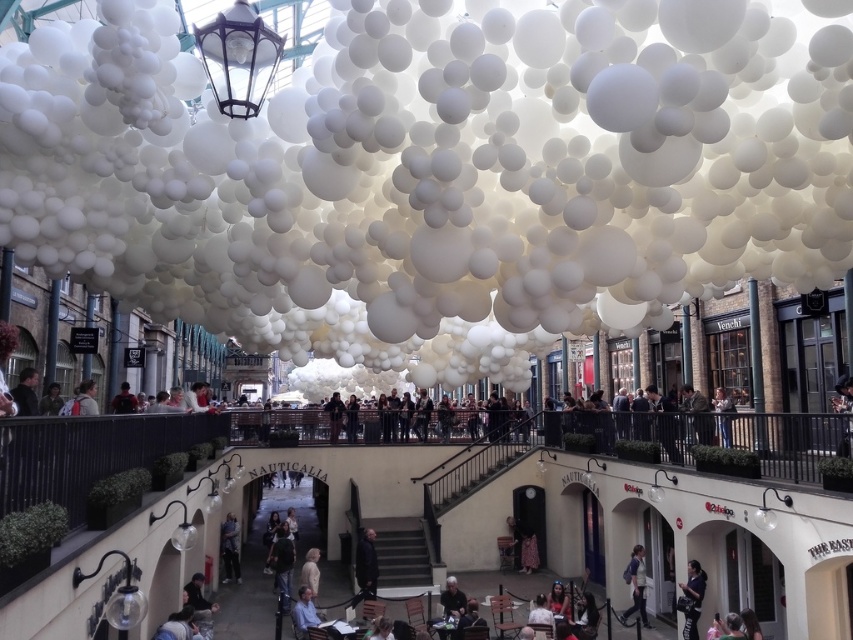
Is light blue shirt at lower center to the right of light beige fabric coat at center from the viewer's perspective?

Yes, light blue shirt at lower center is to the right of light beige fabric coat at center.

Is light blue shirt at lower center above light beige fabric coat at center?

Indeed, light blue shirt at lower center is positioned over light beige fabric coat at center.

Does point (305, 589) come closer to viewer compared to point (317, 584)?

Yes, point (305, 589) is in front of point (317, 584).

The height and width of the screenshot is (640, 853). What are the coordinates of `light blue shirt at lower center` in the screenshot? It's located at (305, 612).

Does white matte balloon at center come in front of dark gray fabric jacket at lower center?

Yes.

In the scene shown: Between white matte balloon at center and dark gray fabric jacket at lower center, which one has more height?

white matte balloon at center is taller.

Identify the location of white matte balloon at center. The image size is (853, 640). (439, 166).

Can you confirm if dark gray jacket at lower left is positioned to the left of matte black jacket at center?

In fact, dark gray jacket at lower left is to the right of matte black jacket at center.

Who is taller, dark gray jacket at lower left or matte black jacket at center?

dark gray jacket at lower left is taller.

Does point (209, 634) lie behind point (120, 387)?

No, it is not.

This screenshot has width=853, height=640. I want to click on dark gray jacket at lower left, so click(199, 605).